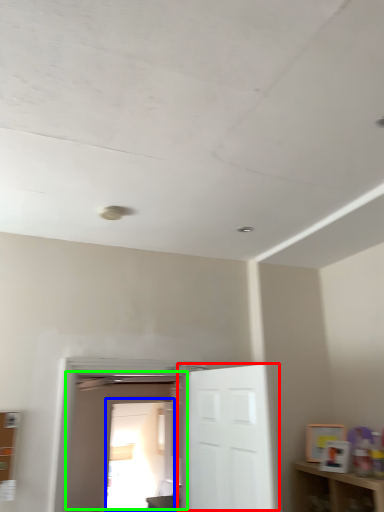
Question: Based on their relative distances, which object is farther from door (highlighted by a red box)? Choose from glass door (highlighted by a blue box) and door (highlighted by a green box).

Choices:
 (A) glass door
 (B) door

Answer: (A)